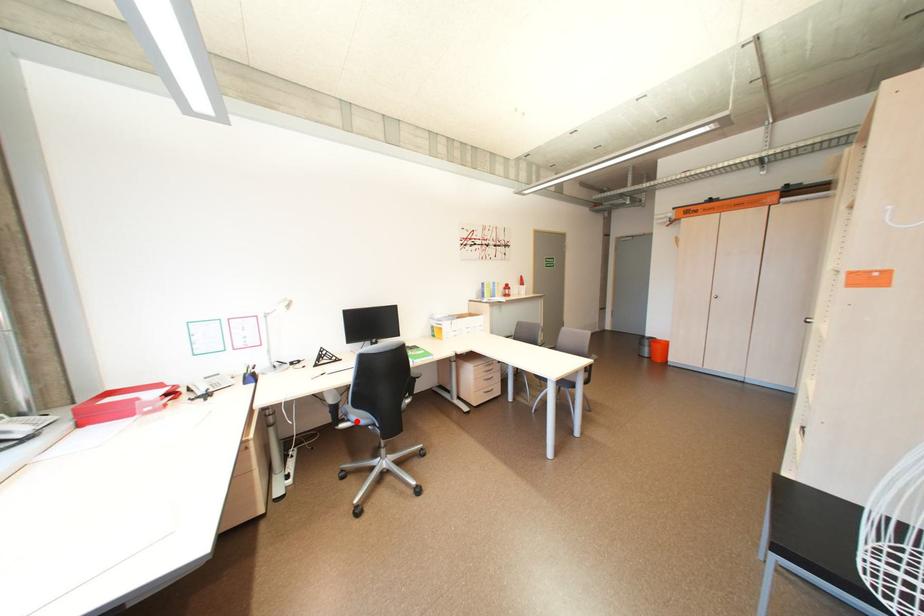
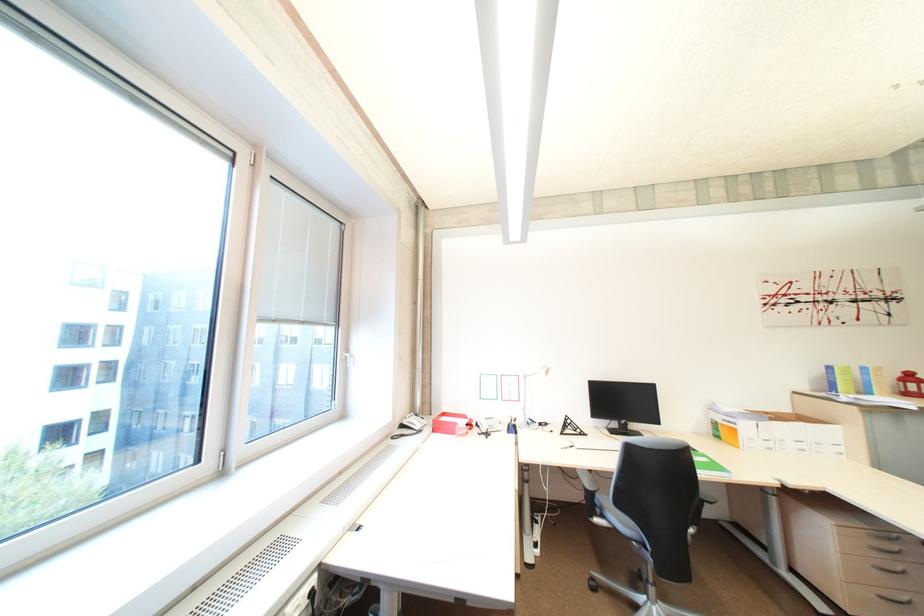
Where in the second image is the point corresponding to the highlighted location from the first image?

(612, 517)